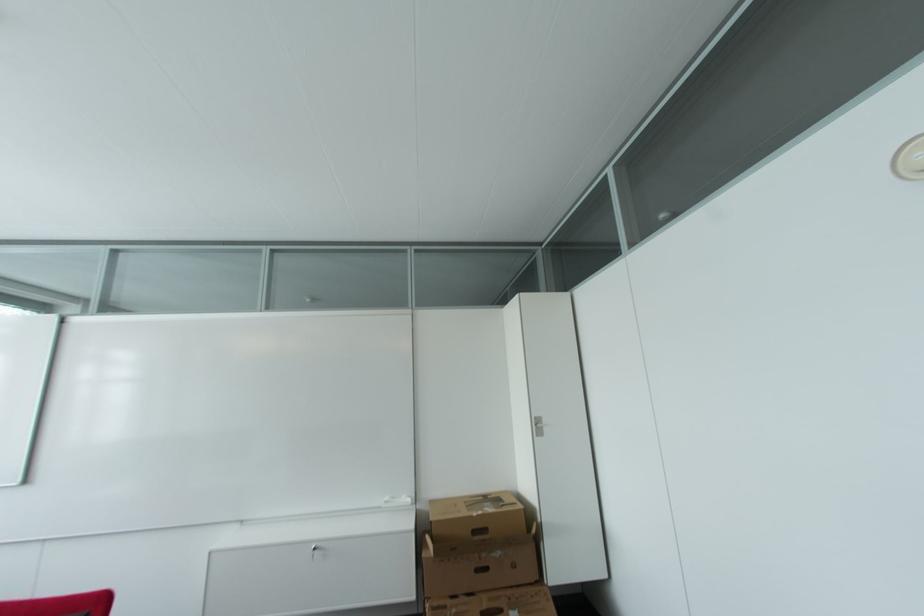
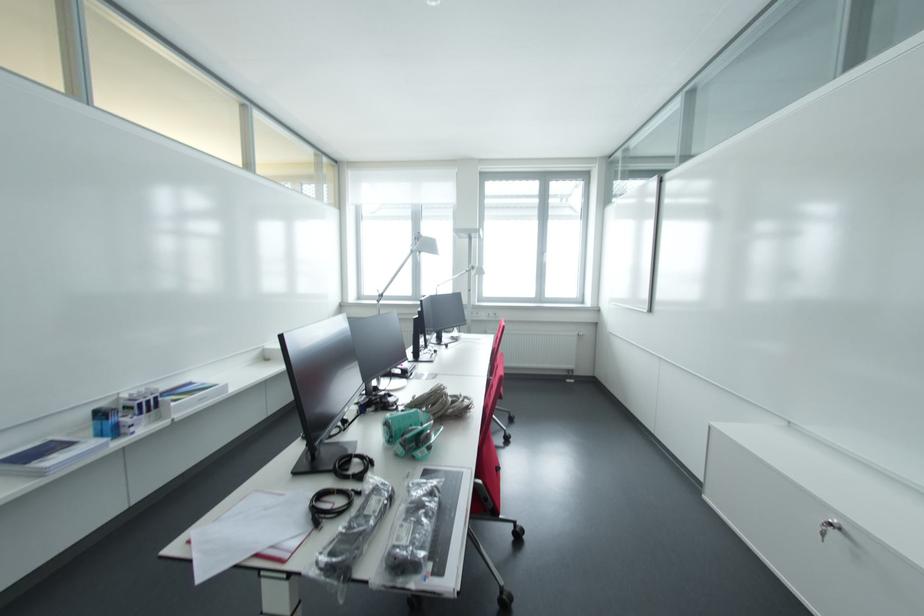
Find the pixel in the second image that matches point 317,549 in the first image.

(836, 525)